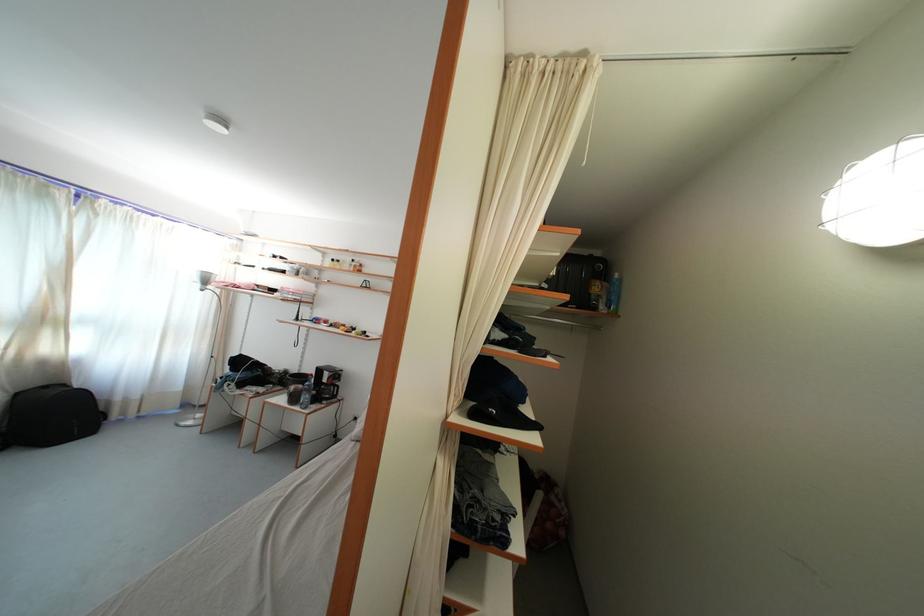
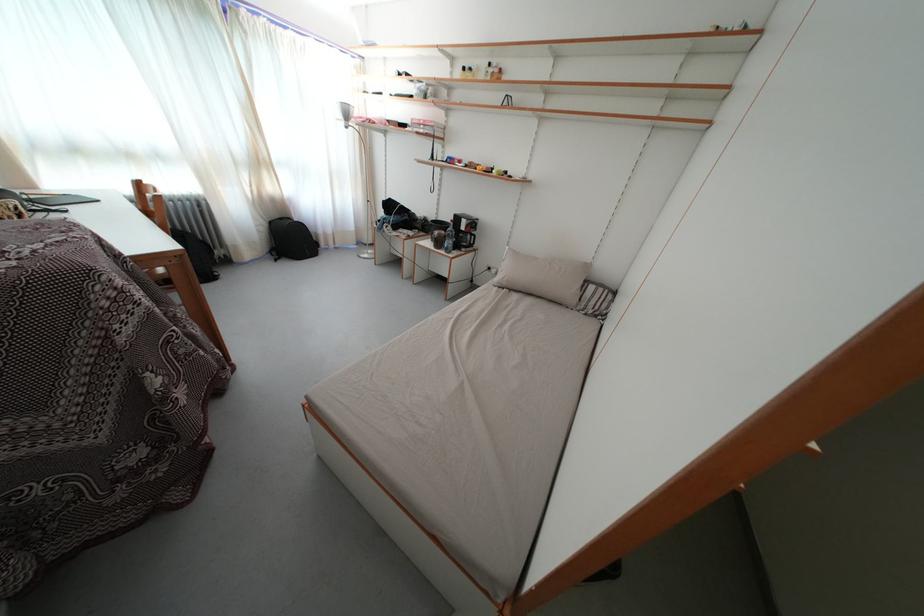
Locate, in the second image, the point that corresponds to (x=329, y=392) in the first image.

(467, 240)